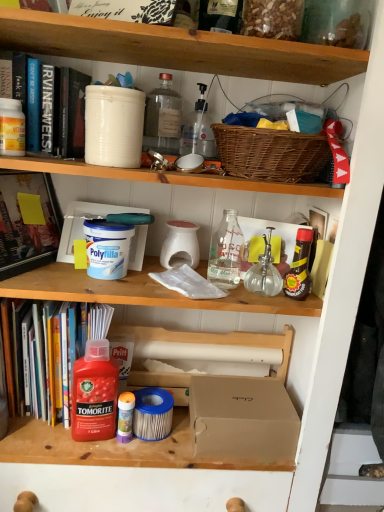
At what (x,y) coordinates should I click in order to perform the action: click on free space above brown cardboard box at center, which is the 1th box from bottom to top (from a real-world perspective). Please return your answer as a coordinate pair (x, y). The image size is (384, 512). Looking at the image, I should click on (238, 396).